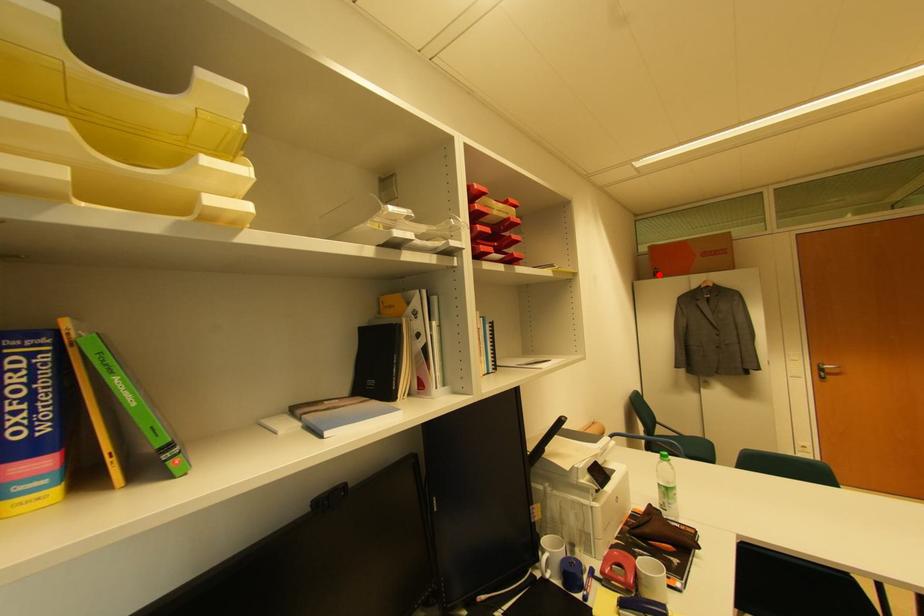
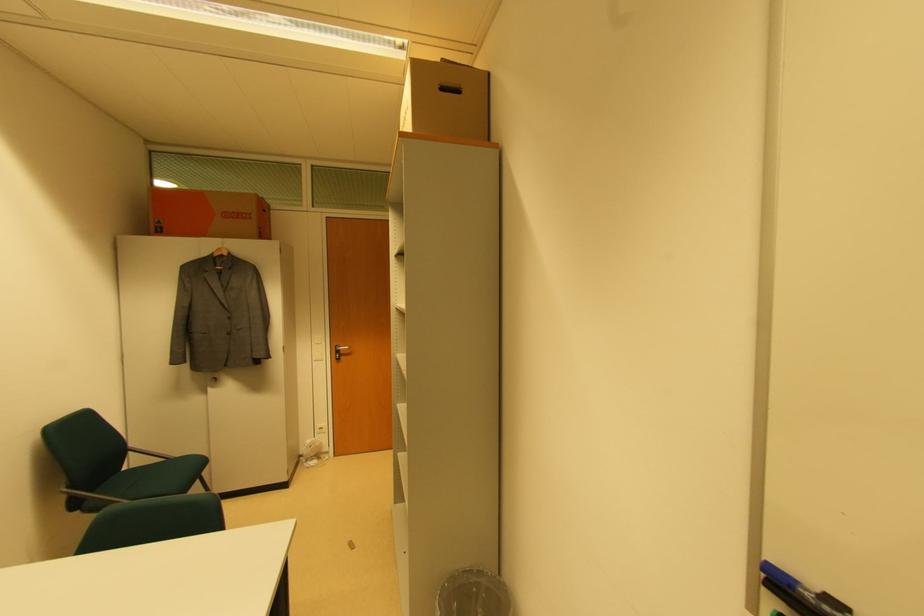
Find the pixel in the second image that matches the highlighted location in the first image.

(163, 230)